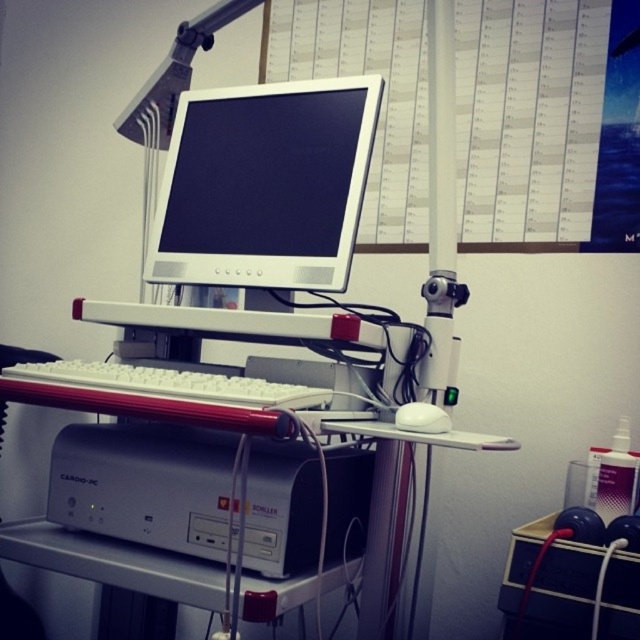
You are a nurse entering the clinical workspace and need to place a white matte mouse at center on top of the white plastic computer desk at center. Will the mouse fit on the desk?

The white plastic computer desk at center is taller than the white matte mouse at center, so the mouse will fit on the desk since height is not an issue for placement.

Consider the image. You are a nurse in a clinic who needs to print a patient report. You see a silver metallic printer at lower center and a white plastic computer desk at center. Which object is closer to the left side of the desk?

The silver metallic printer at lower center is to the left of the white plastic computer desk at center, so it is closer to the left side of the desk.

You are a nurse in a hospital room and need to access the medical equipment labeled CARDIO PC. You see the white plastic computer desk at center and the white matte mouse at center. Which object is closer to the floor?

The white plastic computer desk at center is located below the white matte mouse at center, so the white plastic computer desk at center is closer to the floor.